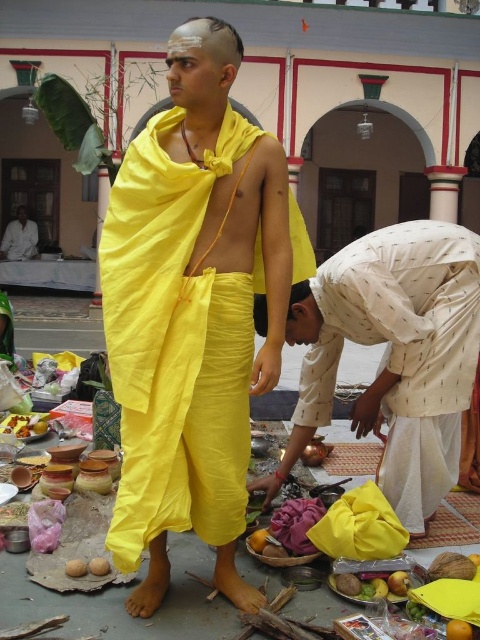
Identify the location of white dotted fabric at lower right. (403, 349).

Who is more forward, (322,388) or (359,588)?

Point (359,588)

Where is `white dotted fabric at lower right`? Image resolution: width=480 pixels, height=640 pixels. white dotted fabric at lower right is located at coordinates (403, 349).

Is yellow cloth at center behind smooth brown coconut at lower center?

No, yellow cloth at center is in front of smooth brown coconut at lower center.

The image size is (480, 640). Identify the location of yellow cloth at center. (192, 310).

Does point (220, 115) lie in front of point (351, 582)?

No, it is not.

In order to click on yellow cloth at center in this screenshot , I will do `click(192, 310)`.

Between point (338, 586) and point (466, 628), which one is positioned behind?

The point (338, 586) is behind.

Is point (334, 579) positioned behind point (459, 632)?

Yes, it is behind point (459, 632).

Who is more forward, (358, 593) or (472, 632)?

Positioned in front is point (472, 632).

The height and width of the screenshot is (640, 480). What are the coordinates of `smooth brown coconut at lower center` in the screenshot? It's located at (348, 582).